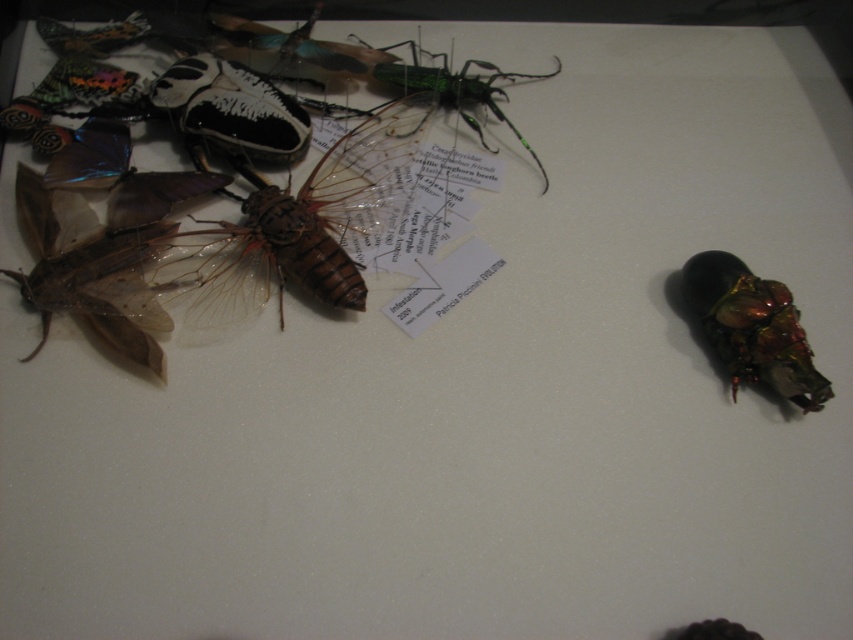
Question: Does brown translucent wing at center have a larger size compared to brown translucent wings at left?

Choices:
 (A) yes
 (B) no

Answer: (A)

Question: Considering the real-world distances, which object is closest to the metallic iridescent beetle at right?

Choices:
 (A) brown translucent wing at center
 (B) brown translucent wings at left

Answer: (A)

Question: Can you confirm if brown translucent wing at center is positioned to the left of brown translucent wings at left?

Choices:
 (A) yes
 (B) no

Answer: (B)

Question: Is brown translucent wings at left thinner than metallic iridescent beetle at right?

Choices:
 (A) yes
 (B) no

Answer: (B)

Question: Among these points, which one is nearest to the camera?

Choices:
 (A) (357, 164)
 (B) (730, 257)
 (C) (134, 253)

Answer: (C)

Question: Which is farther from the brown translucent wing at center?

Choices:
 (A) brown translucent wings at left
 (B) metallic iridescent beetle at right

Answer: (B)